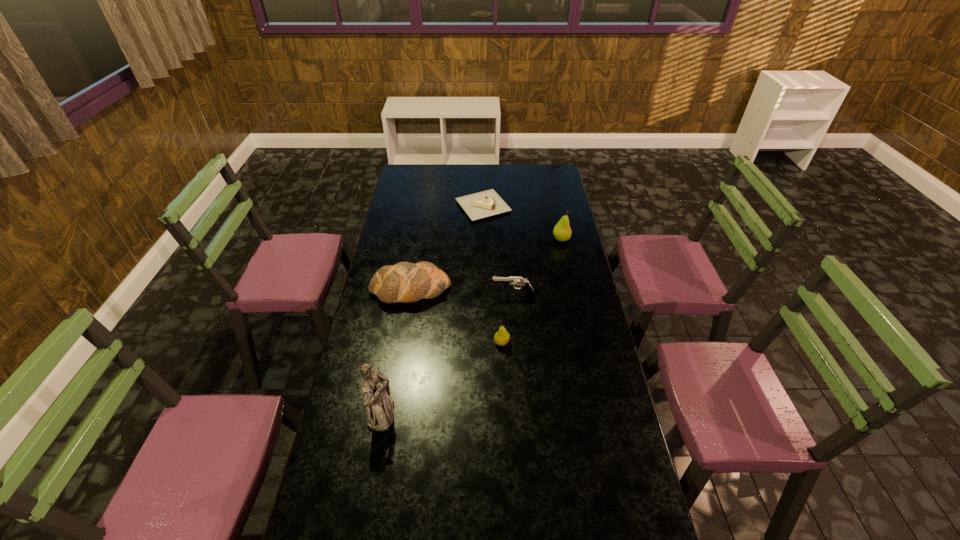
I want to click on object that is positioned at the right edge, so click(562, 232).

Where is `vacant space at the near edge of the desktop`? The width and height of the screenshot is (960, 540). vacant space at the near edge of the desktop is located at coordinates (575, 523).

In the image, there is a desktop. Where is `vacant area at the left edge`? vacant area at the left edge is located at coordinates (399, 314).

In the image, there is a desktop. At what (x,y) coordinates should I click in order to perform the action: click on vacant space at the right edge. Please return your answer as a coordinate pair (x, y). The image size is (960, 540). Looking at the image, I should click on (619, 461).

Where is `free point at the far left corner`? The width and height of the screenshot is (960, 540). free point at the far left corner is located at coordinates (410, 185).

The width and height of the screenshot is (960, 540). I want to click on vacant space in between the gun and the cake, so click(498, 251).

I want to click on empty location between the taller pear and the nearest object, so click(x=471, y=326).

What are the coordinates of `vacant space in between the gun and the bread` in the screenshot? It's located at (462, 292).

Locate an element on the screen. The image size is (960, 540). vacant point located between the farthest object and the bread is located at coordinates (446, 248).

The height and width of the screenshot is (540, 960). I want to click on vacant region between the bread and the gun, so click(x=462, y=292).